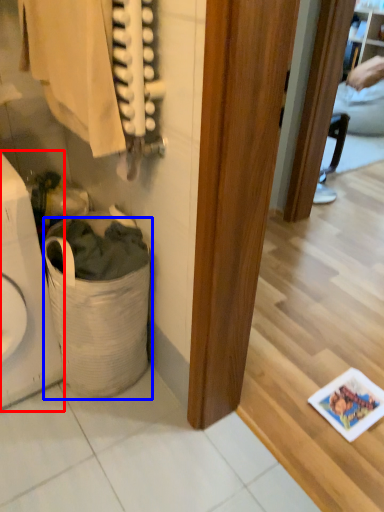
Question: Which object is closer to the camera taking this photo, appliance (highlighted by a red box) or laundry basket (highlighted by a blue box)?

Choices:
 (A) appliance
 (B) laundry basket

Answer: (A)